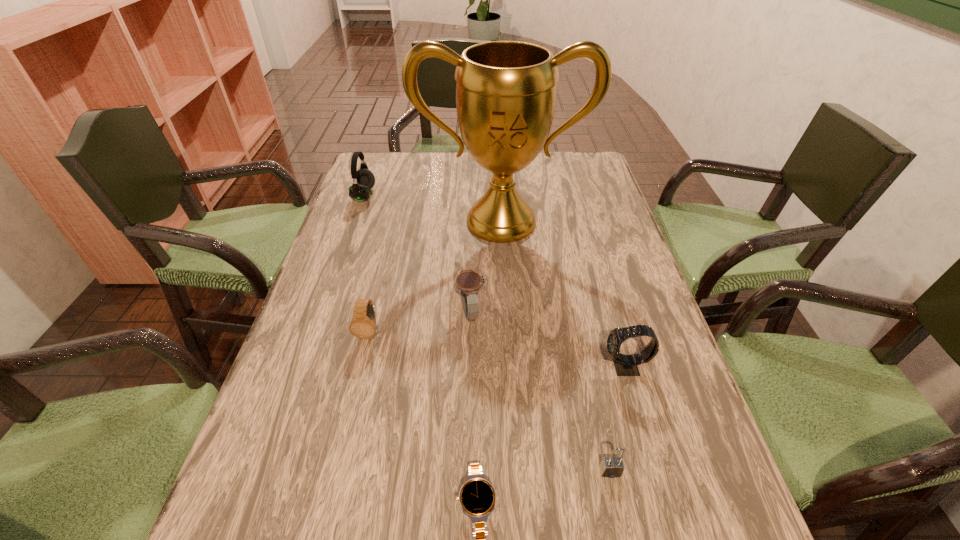
At what (x,y) coordinates should I click in order to perform the action: click on object that can be found as the closest to the tallest object. Please return your answer as a coordinate pair (x, y). Looking at the image, I should click on (363, 180).

Select which object appears as the third closest to the sixth object from right to left. Please provide its 2D coordinates. Your answer should be formatted as a tuple, i.e. [(x, y)], where the tuple contains the x and y coordinates of a point satisfying the conditions above.

[(477, 497)]

Where is `watch that stands as the fourth closest to the tallest object`? watch that stands as the fourth closest to the tallest object is located at coordinates (477, 497).

You are a GUI agent. You are given a task and a screenshot of the screen. Output one action in this format:
    pyautogui.click(x=<x>, y=<y>)
    Task: Click on the watch that stands as the third closest to the tallest object
    
    Given the screenshot: What is the action you would take?
    tap(625, 365)